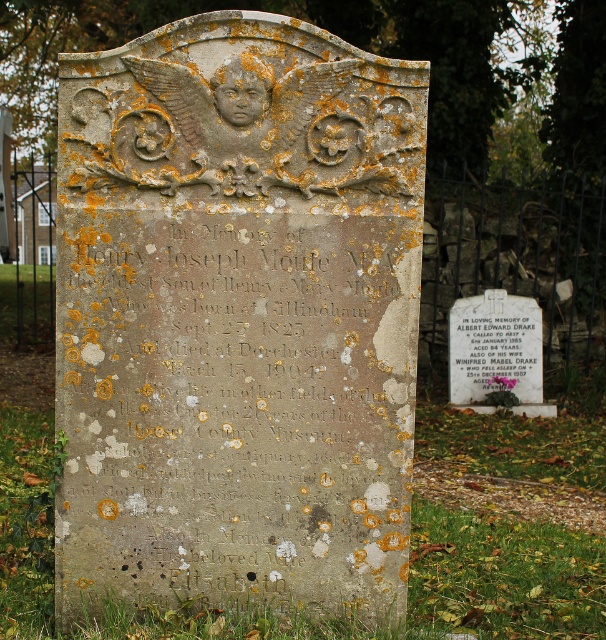
Is speckled stone tombstone at center positioned at the back of white paper at center?

No, speckled stone tombstone at center is in front of white paper at center.

Where is `speckled stone tombstone at center`? speckled stone tombstone at center is located at coordinates (238, 316).

Locate an element on the screen. Image resolution: width=606 pixels, height=640 pixels. speckled stone tombstone at center is located at coordinates (238, 316).

You are a GUI agent. You are given a task and a screenshot of the screen. Output one action in this format:
    pyautogui.click(x=<x>, y=<y>)
    Task: Click on the speckled stone tombstone at center
    The height and width of the screenshot is (640, 606).
    Given the screenshot: What is the action you would take?
    pyautogui.click(x=238, y=316)

Measure the distance between point (310, 536) and camera.

3.67 meters

Who is more forward, (230,461) or (459,308)?

Point (230,461)

The image size is (606, 640). In order to click on speckled stone tombstone at center in this screenshot , I will do `click(238, 316)`.

Between white marble plaque at center and white paper at center, which one appears on the left side from the viewer's perspective?

From the viewer's perspective, white paper at center appears more on the left side.

Based on the photo, is white marble plaque at center in front of white paper at center?

Yes, white marble plaque at center is closer to the viewer.

The width and height of the screenshot is (606, 640). What do you see at coordinates (496, 352) in the screenshot?
I see `white marble plaque at center` at bounding box center [496, 352].

Find the location of a particular element. The height and width of the screenshot is (640, 606). white marble plaque at center is located at coordinates (496, 352).